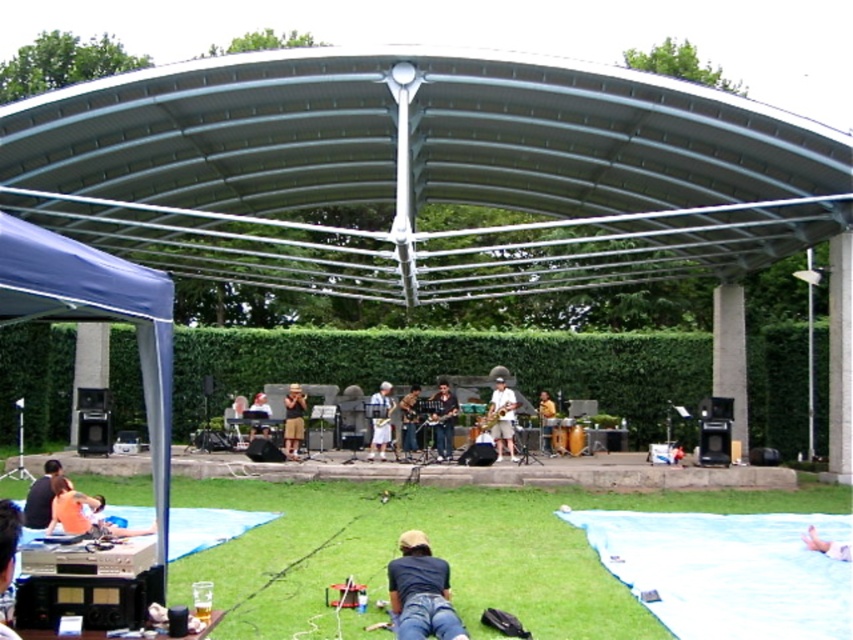
Question: Estimate the real-world distances between objects in this image. Which object is farther from the gold metallic saxophone at center?

Choices:
 (A) matte black shirt at lower left
 (B) yellow fabric saxophone at center

Answer: (A)

Question: Considering the real-world distances, which object is farthest from the yellow fabric saxophone at center?

Choices:
 (A) light brown wooden chair at center
 (B) smooth skin at lower right

Answer: (B)

Question: Can you confirm if orange cotton shirt at lower left is positioned to the right of matte brown saxophone at center?

Choices:
 (A) yes
 (B) no

Answer: (B)

Question: From the image, what is the correct spatial relationship of green grass at lower center in relation to yellow fabric saxophone at center?

Choices:
 (A) left
 (B) right

Answer: (A)

Question: Does metallic gray pergola at center come in front of white fabric saxophone at center?

Choices:
 (A) yes
 (B) no

Answer: (A)

Question: Based on their relative distances, which object is farther from the matte black guitar at center?

Choices:
 (A) dark blue jeans at lower center
 (B) matte brown saxophone at center

Answer: (A)